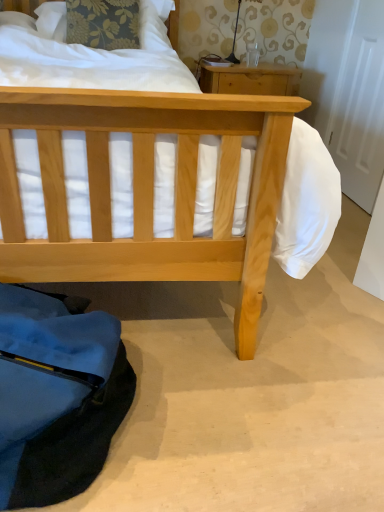
Question: From a real-world perspective, does natural wood nightstand at upper center sit lower than matte black lamp at upper center?

Choices:
 (A) no
 (B) yes

Answer: (B)

Question: From the image's perspective, would you say natural wood nightstand at upper center is positioned over matte black lamp at upper center?

Choices:
 (A) no
 (B) yes

Answer: (A)

Question: Does natural wood nightstand at upper center have a greater width compared to matte black lamp at upper center?

Choices:
 (A) no
 (B) yes

Answer: (B)

Question: Can you confirm if natural wood nightstand at upper center is bigger than matte black lamp at upper center?

Choices:
 (A) no
 (B) yes

Answer: (B)

Question: Considering the relative positions of natural wood nightstand at upper center and matte black lamp at upper center in the image provided, is natural wood nightstand at upper center to the left of matte black lamp at upper center from the viewer's perspective?

Choices:
 (A) yes
 (B) no

Answer: (B)

Question: Does natural wood nightstand at upper center have a lesser height compared to matte black lamp at upper center?

Choices:
 (A) yes
 (B) no

Answer: (B)

Question: Is matte black lamp at upper center facing towards natural wood nightstand at upper center?

Choices:
 (A) no
 (B) yes

Answer: (A)

Question: Is matte black lamp at upper center not within natural wood nightstand at upper center?

Choices:
 (A) no
 (B) yes

Answer: (B)

Question: Is matte black lamp at upper center closer to camera compared to natural wood nightstand at upper center?

Choices:
 (A) yes
 (B) no

Answer: (B)

Question: Is matte black lamp at upper center shorter than natural wood nightstand at upper center?

Choices:
 (A) no
 (B) yes

Answer: (B)

Question: Is the surface of matte black lamp at upper center in direct contact with natural wood nightstand at upper center?

Choices:
 (A) yes
 (B) no

Answer: (B)

Question: Does matte black lamp at upper center appear on the left side of natural wood nightstand at upper center?

Choices:
 (A) no
 (B) yes

Answer: (B)

Question: Considering the relative sizes of matte black lamp at upper center and floral fabric pillow at upper left in the image provided, is matte black lamp at upper center shorter than floral fabric pillow at upper left?

Choices:
 (A) no
 (B) yes

Answer: (A)